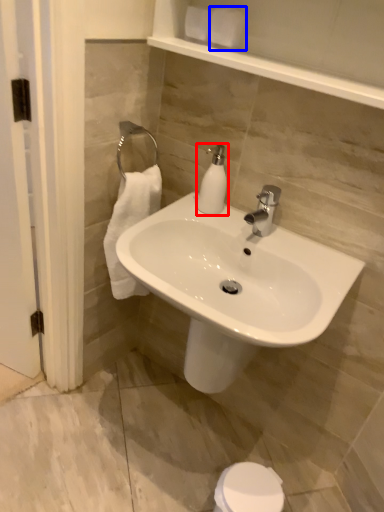
Question: Which point is further to the camera, soap dispenser (highlighted by a red box) or toilet paper (highlighted by a blue box)?

Choices:
 (A) soap dispenser
 (B) toilet paper

Answer: (A)